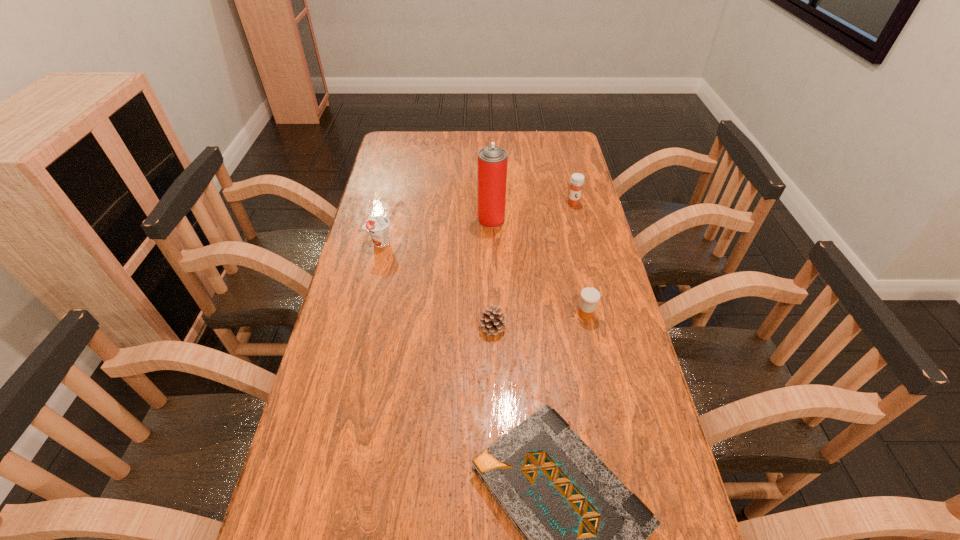
Identify the location of free point between the taller medicine and the nearer medicine. This screenshot has width=960, height=540. (580, 259).

Locate an element on the screen. The image size is (960, 540). free space between the second tallest object and the tallest object is located at coordinates (532, 212).

The image size is (960, 540). I want to click on vacant point located between the yogurt and the nearer medicine, so click(x=483, y=278).

This screenshot has height=540, width=960. I want to click on unoccupied position between the pinecone and the tallest object, so click(492, 273).

Locate an element on the screen. This screenshot has height=540, width=960. free space between the nearer medicine and the pinecone is located at coordinates (539, 321).

Choose which object is the fifth nearest neighbor to the pinecone. Please provide its 2D coordinates. Your answer should be formatted as a tuple, i.e. [(x, y)], where the tuple contains the x and y coordinates of a point satisfying the conditions above.

[(577, 179)]

Image resolution: width=960 pixels, height=540 pixels. What are the coordinates of `object that is the closest to the nearest object` in the screenshot? It's located at (492, 320).